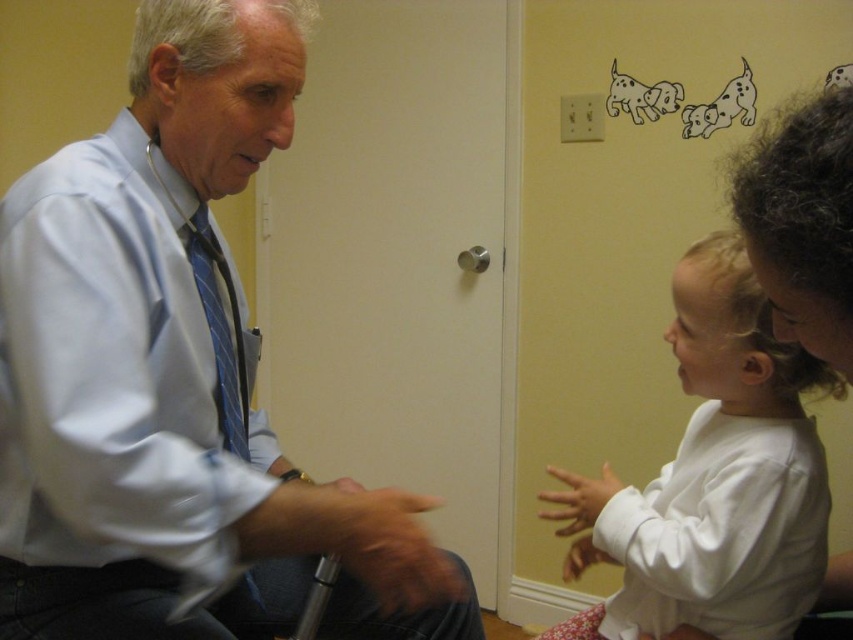
You are a tailor measuring shirts for a customer. You have two shirts in front of you, the matte blue dress shirt at left and the white soft shirt at right. The customer says they need the taller shirt. Which one should you give them?

The white soft shirt at right is taller than the matte blue dress shirt at left, so you should give the customer the white soft shirt at right.

You are a patient in a clinic and see the white soft shirt at right and the blue striped tie at left. Which one is located on the right side of the clinic room?

The white soft shirt at right is located on the right side of the clinic room.

You are a photographer standing in the scene. You want to take a photo of both the matte blue dress shirt at left and the white soft shirt at right. Which shirt should you focus on first to ensure both are in focus?

The matte blue dress shirt at left is closer to the viewer than the white soft shirt at right, so focus on the matte blue dress shirt at left first to ensure both are in focus.